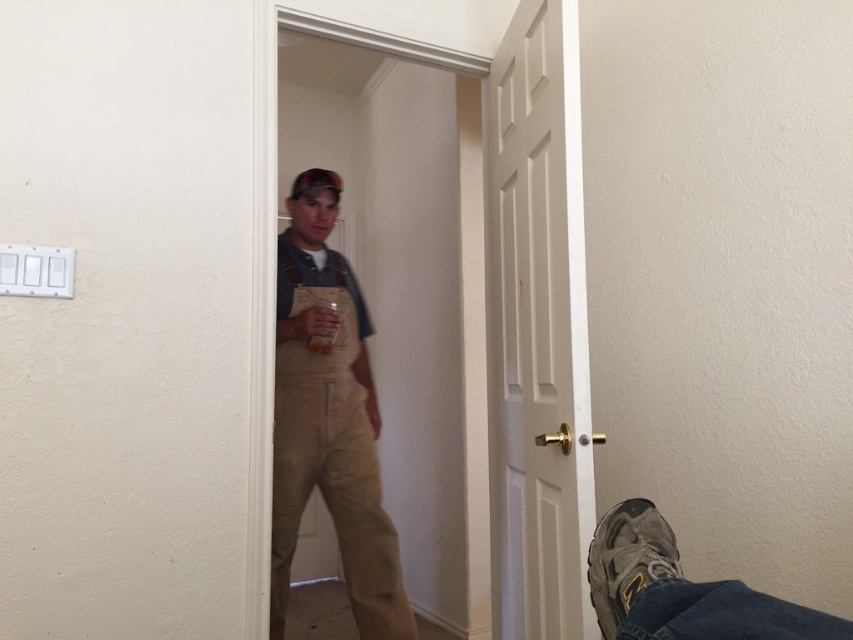
Question: Which of the following is the farthest from the observer?

Choices:
 (A) white matte door at center
 (B) brown suede shoe at lower right

Answer: (A)

Question: Is white matte door at center closer to camera compared to brown suede shoe at lower right?

Choices:
 (A) no
 (B) yes

Answer: (A)

Question: Which point is farther to the camera?

Choices:
 (A) (636, 572)
 (B) (618, 586)
 (C) (283, 520)

Answer: (C)

Question: Does khaki overalls at center have a smaller size compared to tan suede shoe at lower right?

Choices:
 (A) yes
 (B) no

Answer: (B)

Question: Which point is closer to the camera?

Choices:
 (A) white matte door at center
 (B) khaki overalls at center
 (C) brown suede shoe at lower right

Answer: (C)

Question: Is white matte door at center wider than khaki overalls at center?

Choices:
 (A) no
 (B) yes

Answer: (A)